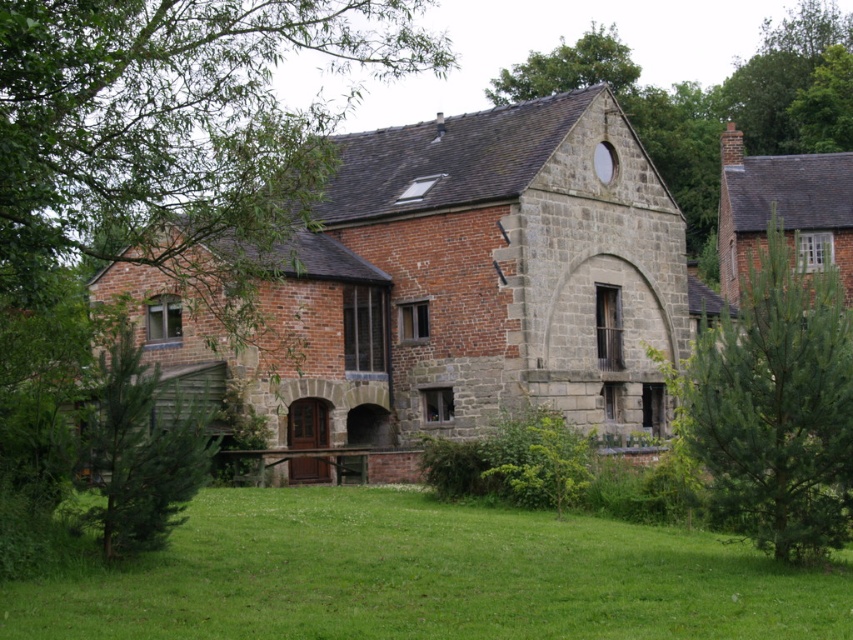
Question: Can you confirm if green textured tree at lower left is positioned above green leafy tree at upper center?

Choices:
 (A) no
 (B) yes

Answer: (A)

Question: Is green grass at lower center to the right of green textured tree at lower left from the viewer's perspective?

Choices:
 (A) no
 (B) yes

Answer: (B)

Question: Among these points, which one is nearest to the camera?

Choices:
 (A) (817, 124)
 (B) (177, 476)
 (C) (538, 61)

Answer: (B)

Question: Which object is positioned closest to the green needle-like tree at center-right?

Choices:
 (A) green grass at lower center
 (B) brick stone chapel at center

Answer: (A)

Question: Which of the following is the closest to the observer?

Choices:
 (A) (827, 131)
 (B) (515, 74)

Answer: (A)

Question: Is brick stone chapel at center to the right of green textured tree at lower left from the viewer's perspective?

Choices:
 (A) yes
 (B) no

Answer: (A)